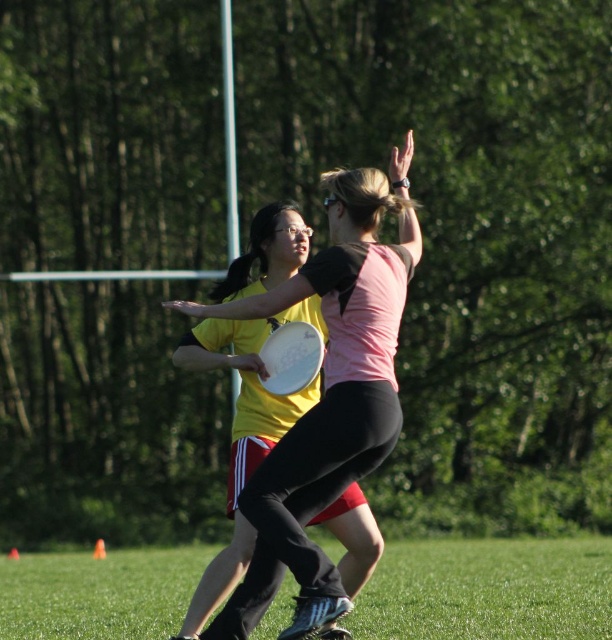
You are a player in an ultimate frisbee game on the grassy field. You see the green grass at lower center and the matte white frisbee at center. Which object is closer to you?

The green grass at lower center is closer to you because the matte white frisbee at center is behind it.

You are a player in an ultimate frisbee game on a grassy field. You want to run from the green grass at lower center to catch the white matte frisbee at center. Can you reach it before it lands?

The distance between the green grass at lower center and the white matte frisbee at center is 3.66 meters. If you can sprint that distance quickly enough before the frisbee lands, you might be able to catch it. However, this depends on your running speed and the frisbee trajectory.